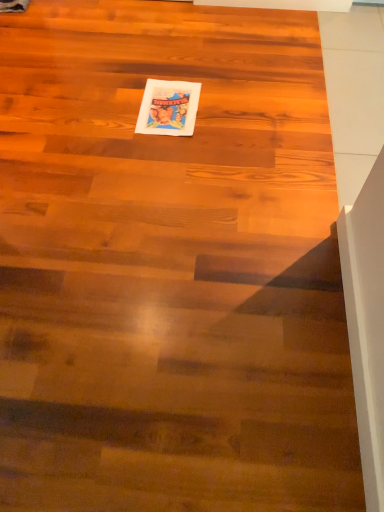
In order to click on free space behind white paper book at center in this screenshot , I will do `click(168, 65)`.